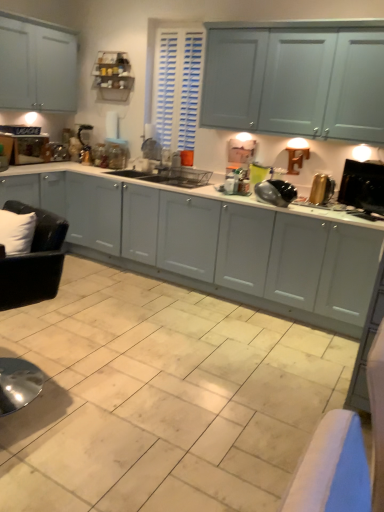
Question: In the image, is matte white cabinets at center on the left side or the right side of beige ceramic tile at center?

Choices:
 (A) left
 (B) right

Answer: (B)

Question: Considering the positions of matte white cabinets at center and beige ceramic tile at center in the image, is matte white cabinets at center bigger or smaller than beige ceramic tile at center?

Choices:
 (A) big
 (B) small

Answer: (A)

Question: Which object is positioned closest to the gold metallic toaster at right, acting as the second appliance starting from the left?

Choices:
 (A) matte white cabinets at center
 (B) black plastic monitor at right, positioned as the third appliance in left-to-right order
 (C) black glossy pan at center, which ranks as the third appliance in right-to-left order
 (D) beige ceramic tile at center

Answer: (B)

Question: Based on their relative distances, which object is nearer to the gold metallic toaster at right, the second appliance when ordered from right to left?

Choices:
 (A) beige ceramic tile at center
 (B) black plastic monitor at right, positioned as the third appliance in left-to-right order
 (C) matte white cabinets at center
 (D) black glossy pan at center, which is counted as the 1th appliance, starting from the left

Answer: (B)